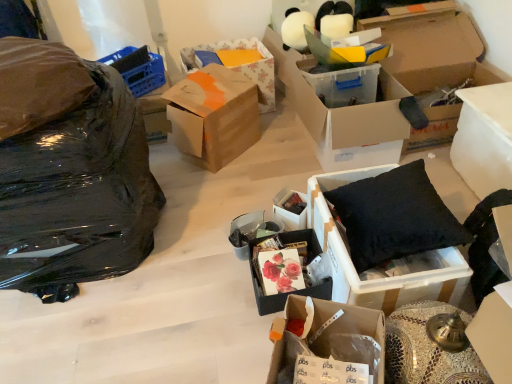
I want to click on vacant space to the left of transparent plastic box at center, which ranks as the 3th box in right-to-left order, so click(268, 162).